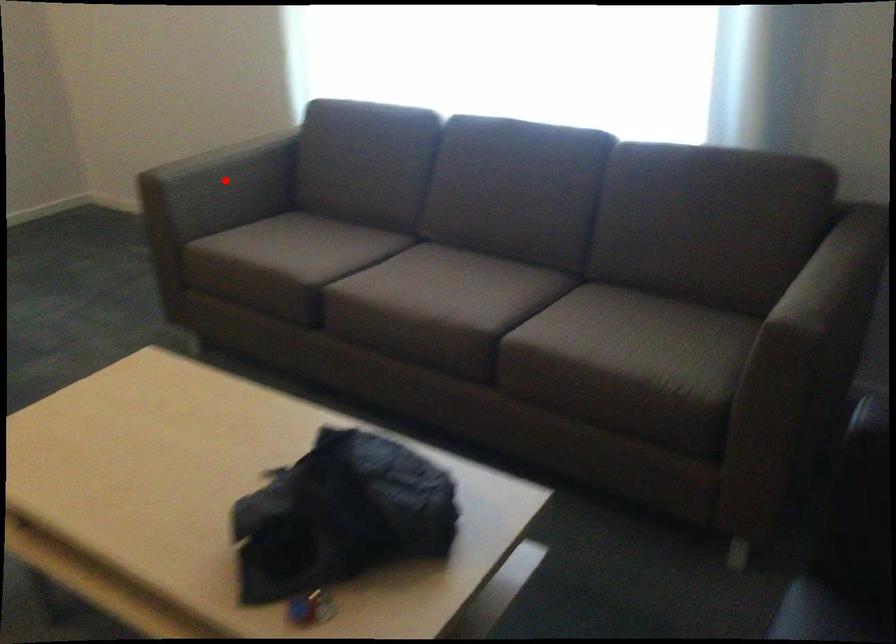
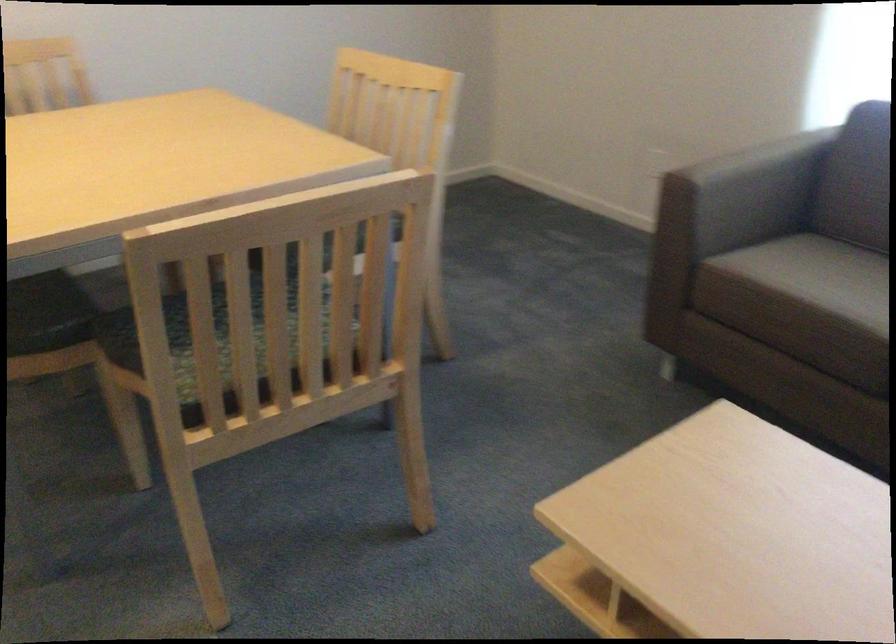
Question: A red point is marked in image1. In image2, is the corresponding 3D point closer to the camera or farther? Reply with the corresponding letter.

Choices:
 (A) The corresponding 3D point is closer.
 (B) The corresponding 3D point is farther.

Answer: (A)